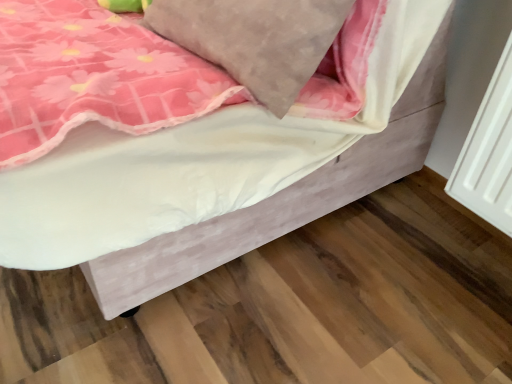
Question: Considering the positions of velvet pink bed at lower right and suede-like gray pillow at upper center in the image, is velvet pink bed at lower right wider or thinner than suede-like gray pillow at upper center?

Choices:
 (A) wide
 (B) thin

Answer: (A)

Question: Is point (231, 132) closer or farther from the camera than point (266, 1)?

Choices:
 (A) closer
 (B) farther

Answer: (B)

Question: Relative to suede-like gray pillow at upper center, is velvet pink bed at lower right in front or behind?

Choices:
 (A) behind
 (B) front

Answer: (B)

Question: From a real-world perspective, is suede-like gray pillow at upper center above or below velvet pink bed at lower right?

Choices:
 (A) above
 (B) below

Answer: (A)

Question: Does point (246, 72) appear closer or farther from the camera than point (233, 246)?

Choices:
 (A) farther
 (B) closer

Answer: (B)

Question: In terms of width, does suede-like gray pillow at upper center look wider or thinner when compared to velvet pink bed at lower right?

Choices:
 (A) wide
 (B) thin

Answer: (B)

Question: Looking at the image, does suede-like gray pillow at upper center seem bigger or smaller compared to velvet pink bed at lower right?

Choices:
 (A) big
 (B) small

Answer: (B)